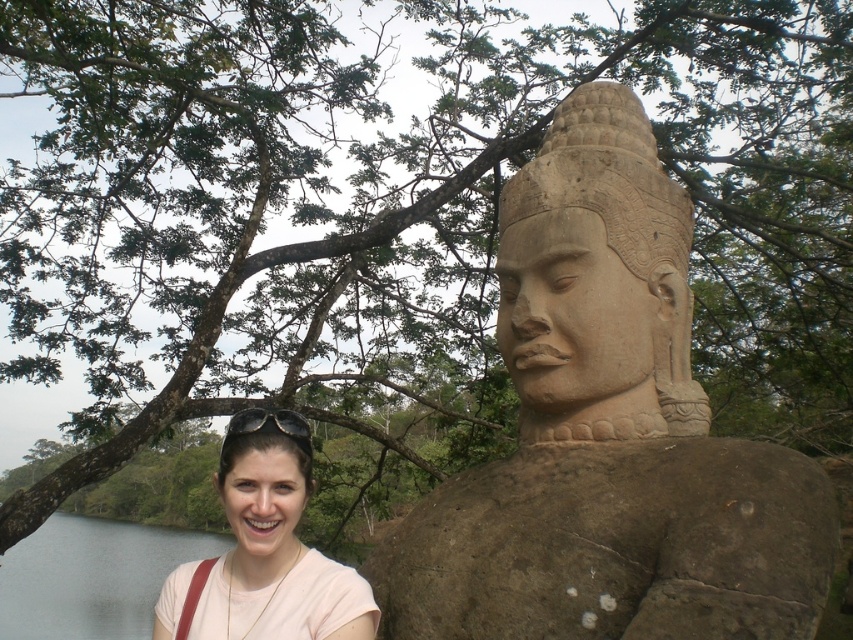
Question: Can you confirm if matte pink shirt at lower left is smaller than stone statue head at center?

Choices:
 (A) yes
 (B) no

Answer: (A)

Question: Estimate the real-world distances between objects in this image. Which object is closer to the black matte sunglasses at lower left?

Choices:
 (A) matte pink shirt at lower left
 (B) matte pink head at lower left

Answer: (B)

Question: In this image, where is brown stone statue at center located relative to matte pink head at lower left?

Choices:
 (A) right
 (B) left

Answer: (A)

Question: Among these points, which one is nearest to the camera?

Choices:
 (A) (283, 412)
 (B) (165, 630)
 (C) (656, 358)

Answer: (A)

Question: Which point is farther to the camera?

Choices:
 (A) brown stone statue at center
 (B) stone statue head at center
 (C) black matte sunglasses at lower left
 (D) matte pink head at lower left

Answer: (B)

Question: Is stone statue head at center below black matte sunglasses at lower left?

Choices:
 (A) no
 (B) yes

Answer: (A)